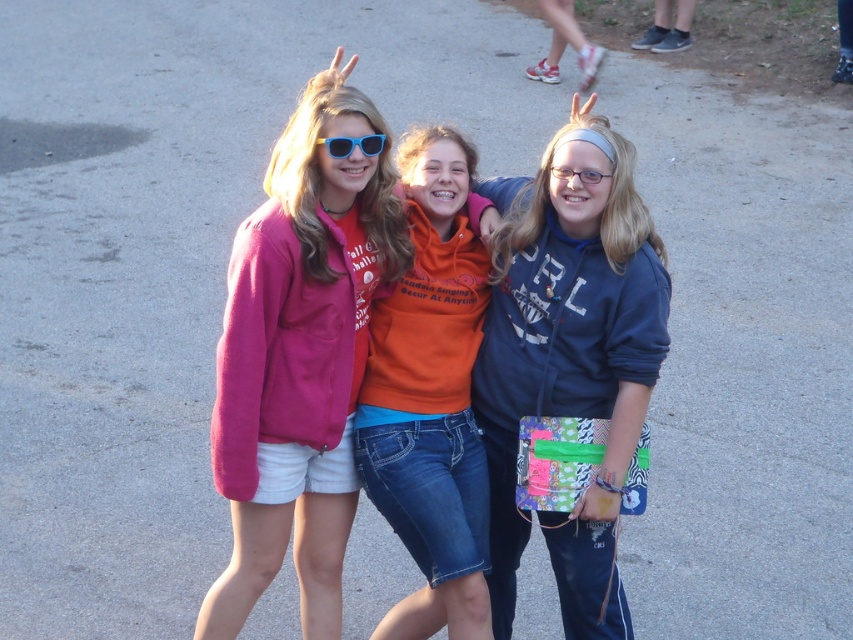
Based on the coordinates provided, which object is located at point [300,356]?

The pink fleece jacket at center is located at point [300,356].

You are a photographer trying to capture a group photo of the matte blue hoodie at center and the matte pink sweatshirt at center. Since you want to ensure both subjects are in focus, you need to know their heights. Which one is taller?

The matte blue hoodie at center is much taller than the matte pink sweatshirt at center, so the photographer should adjust the camera angle to account for the height difference to ensure both are in focus.

You are a tailor who needs to determine which garment requires more fabric between the pink fleece jacket at center and the matte pink sweatshirt at center, based on their sizes in the image. Which one needs more fabric?

The pink fleece jacket at center requires more fabric than the matte pink sweatshirt at center because its width is greater than the sweatshirt.